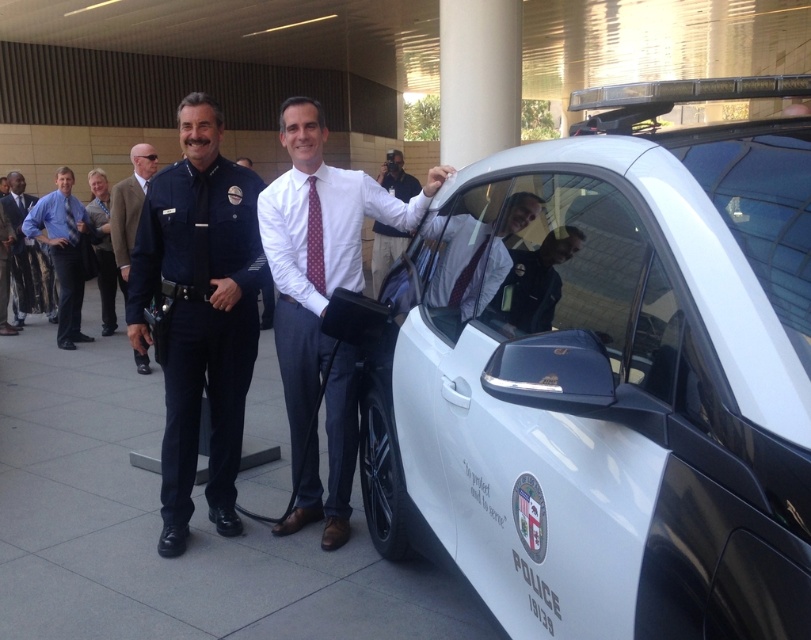
Question: Which object is positioned closest to the dark blue uniform at center?

Choices:
 (A) white glossy suit at center
 (B) brown wool coat at left

Answer: (A)

Question: Is blue shirt at left positioned behind dark gray suit at left?

Choices:
 (A) no
 (B) yes

Answer: (A)

Question: Which point is closer to the camera taking this photo?

Choices:
 (A) (425, 291)
 (B) (372, 288)
 (C) (284, 358)

Answer: (A)

Question: Is dark blue uniform at center thinner than white shirt at center?

Choices:
 (A) no
 (B) yes

Answer: (A)

Question: Which point appears closest to the camera in this image?

Choices:
 (A) (505, 451)
 (B) (140, 166)

Answer: (A)

Question: Is light brown leather jacket at center wider than white shirt at center?

Choices:
 (A) no
 (B) yes

Answer: (B)